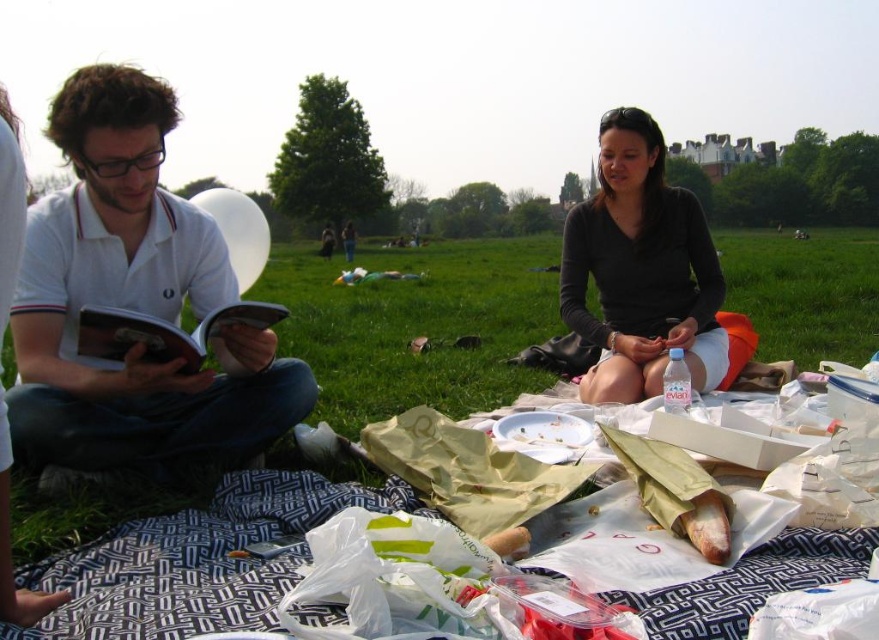
You are a photographer trying to capture the picnic scene. You want to ensure that the white cotton polo shirt at left is visible above the green grass at center in your photo. Based on their heights, is this possible?

The white cotton polo shirt at left is shorter than the green grass at center, so it might not be visible above the grass in the photo.